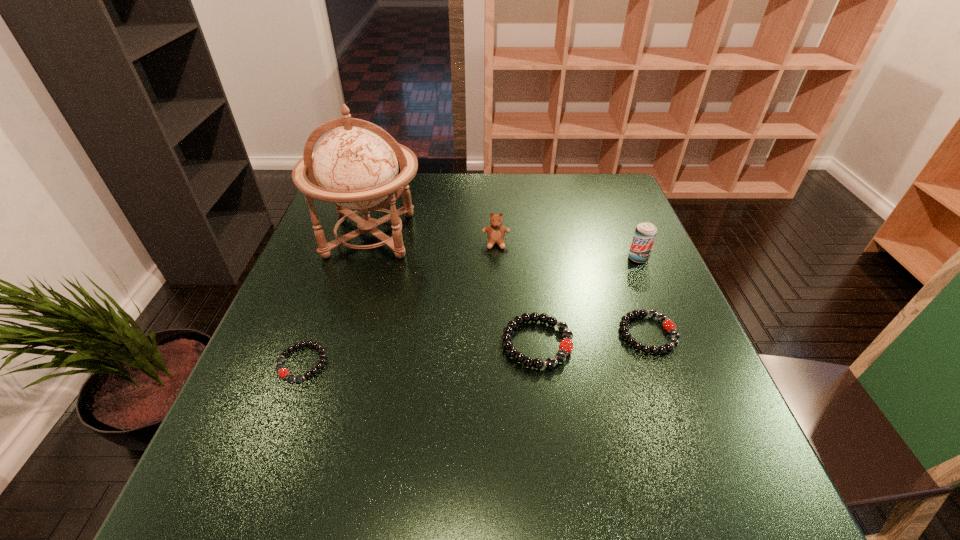
Find the location of a particular element. The width and height of the screenshot is (960, 540). free spot located on the right of the tallest bracelet is located at coordinates (616, 343).

The height and width of the screenshot is (540, 960). I want to click on free space located on the front of the second tallest bracelet, so click(x=665, y=382).

Where is `free location located 0.230m at the front of the tallest object showing Africa`? The height and width of the screenshot is (540, 960). free location located 0.230m at the front of the tallest object showing Africa is located at coordinates (337, 341).

You are a GUI agent. You are given a task and a screenshot of the screen. Output one action in this format:
    pyautogui.click(x=<x>, y=<y>)
    Task: Click on the free spot located on the front-facing side of the teddy bear
    This screenshot has height=540, width=960.
    Given the screenshot: What is the action you would take?
    pyautogui.click(x=501, y=364)

At what (x,y) coordinates should I click in order to perform the action: click on vacant area located on the front of the beer can. Please return your answer as a coordinate pair (x, y). This screenshot has height=540, width=960. Looking at the image, I should click on (690, 384).

Identify the location of object present at the far edge. Image resolution: width=960 pixels, height=540 pixels. (354, 166).

You are a GUI agent. You are given a task and a screenshot of the screen. Output one action in this format:
    pyautogui.click(x=<x>, y=<y>)
    Task: Click on the bracelet at the left edge
    
    Given the screenshot: What is the action you would take?
    pyautogui.click(x=283, y=372)

The image size is (960, 540). I want to click on globe positioned at the left edge, so click(354, 166).

I want to click on bracelet at the right edge, so click(669, 326).

At what (x,y) coordinates should I click in order to perform the action: click on beer can present at the right edge. Please return your answer as a coordinate pair (x, y). Looking at the image, I should click on (645, 233).